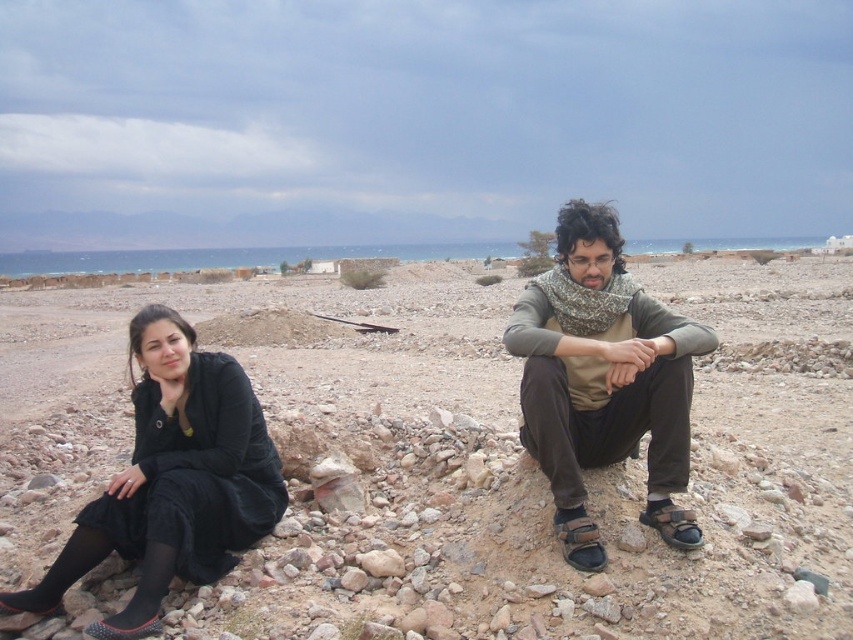
Question: Which is nearer to the black matte dress at lower left?

Choices:
 (A) smooth sand beach at center
 (B) matte brown scarf at center

Answer: (B)

Question: Is smooth sand beach at center smaller than matte brown scarf at center?

Choices:
 (A) no
 (B) yes

Answer: (A)

Question: Which point is closer to the camera?

Choices:
 (A) (132, 321)
 (B) (604, 378)

Answer: (B)

Question: Can you confirm if matte brown scarf at center is smaller than black matte dress at lower left?

Choices:
 (A) no
 (B) yes

Answer: (A)

Question: Which of the following is the farthest from the observer?

Choices:
 (A) matte brown scarf at center
 (B) black matte dress at lower left
 (C) smooth sand beach at center

Answer: (A)

Question: Is smooth sand beach at center to the right of matte brown scarf at center from the viewer's perspective?

Choices:
 (A) no
 (B) yes

Answer: (B)